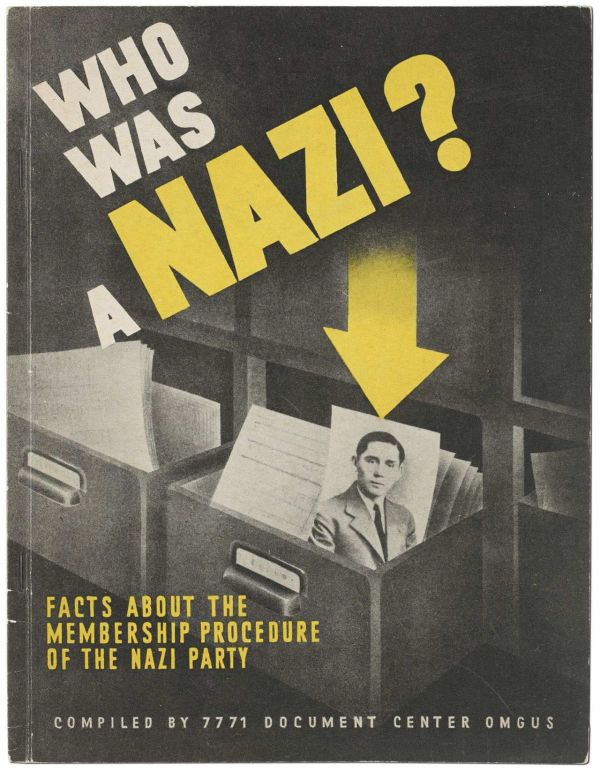
Identify the location of documents. (125, 424), (203, 417), (281, 462), (446, 462), (453, 486), (466, 488), (472, 489), (477, 503), (550, 475).